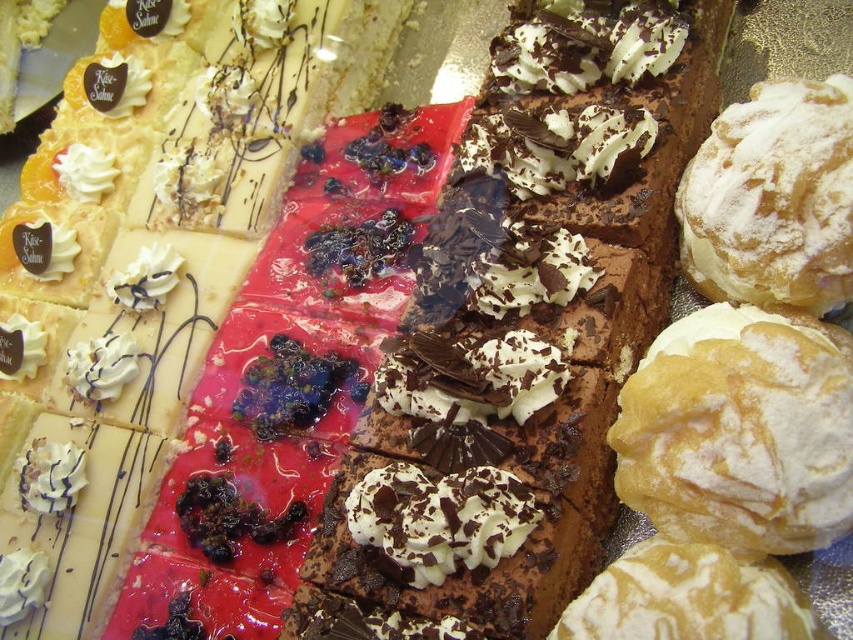
Question: Which object appears closest to the camera in this image?

Choices:
 (A) powdered sugar puff at upper right
 (B) powdered yellow puff pastry at center right
 (C) powdered white cream puff at center right
 (D) whipped cream at center

Answer: (C)

Question: Does powdered yellow puff pastry at center right appear under powdered white cream puff at center right?

Choices:
 (A) no
 (B) yes

Answer: (A)

Question: Does powdered yellow puff pastry at center right appear on the right side of whipped cream at center?

Choices:
 (A) no
 (B) yes

Answer: (B)

Question: Does powdered yellow puff pastry at center right have a larger size compared to whipped cream at center?

Choices:
 (A) yes
 (B) no

Answer: (A)

Question: Which of the following is the farthest from the observer?

Choices:
 (A) powdered white cream puff at center right
 (B) whipped cream at center
 (C) powdered yellow puff pastry at center right

Answer: (B)

Question: Which object is the closest to the powdered white cream puff at center right?

Choices:
 (A) whipped cream at center
 (B) powdered yellow puff pastry at center right
 (C) powdered sugar puff at upper right

Answer: (B)